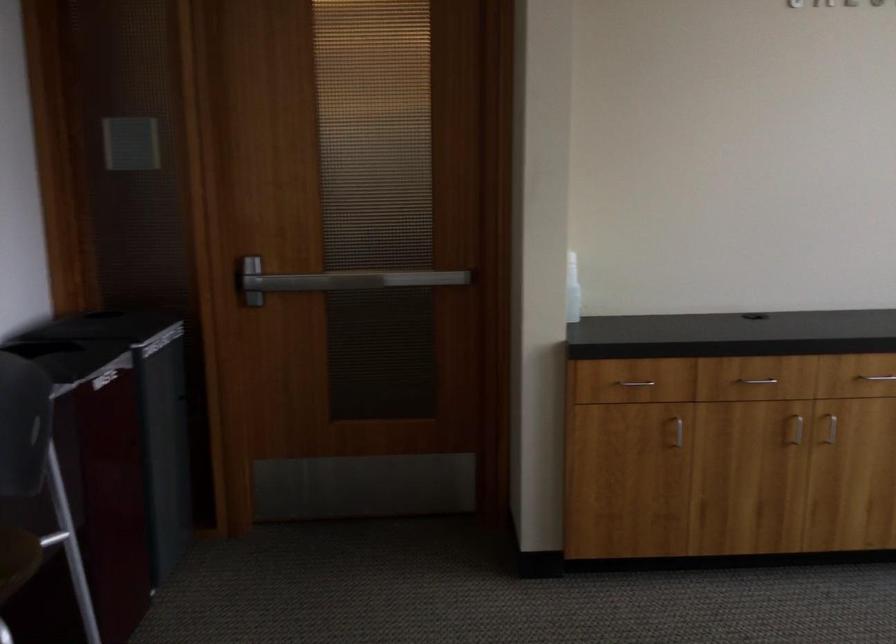
This screenshot has height=644, width=896. Find the location of `metal door push bar`. metal door push bar is located at coordinates (354, 279).